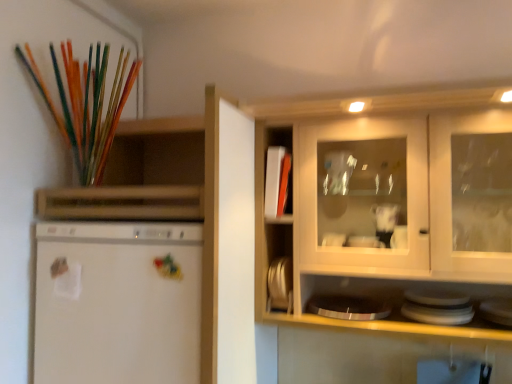
Question: From a real-world perspective, does white glossy plate at lower right, acting as the second appliance starting from the left, sit lower than metallic silver plates at center, the second appliance in the right-to-left sequence?

Choices:
 (A) yes
 (B) no

Answer: (A)

Question: Does white glossy plate at lower right, which is the second appliance from back to front, appear on the left side of metallic silver plates at center, positioned as the first appliance in left-to-right order?

Choices:
 (A) yes
 (B) no

Answer: (B)

Question: Is the position of white glossy plate at lower right, which is the second appliance from back to front, more distant than that of metallic silver plates at center, the second appliance in the right-to-left sequence?

Choices:
 (A) no
 (B) yes

Answer: (A)

Question: Is white glossy plate at lower right, acting as the second appliance starting from the left, wider than metallic silver plates at center, the second appliance in the front-to-back sequence?

Choices:
 (A) yes
 (B) no

Answer: (A)

Question: Is white glossy plate at lower right, which is the second appliance from back to front, oriented towards metallic silver plates at center, the second appliance in the front-to-back sequence?

Choices:
 (A) yes
 (B) no

Answer: (B)

Question: Can you confirm if white glossy plate at lower right, placed as the 1th appliance when sorted from front to back, is bigger than metallic silver plates at center, the second appliance in the front-to-back sequence?

Choices:
 (A) yes
 (B) no

Answer: (A)

Question: Can you confirm if white matte refrigerator at left is smaller than metallic silver plates at center, the second appliance in the right-to-left sequence?

Choices:
 (A) no
 (B) yes

Answer: (A)

Question: Does white matte refrigerator at left have a greater width compared to metallic silver plates at center, the second appliance in the front-to-back sequence?

Choices:
 (A) yes
 (B) no

Answer: (A)

Question: Would you say white matte refrigerator at left contains metallic silver plates at center, positioned as the first appliance in left-to-right order?

Choices:
 (A) yes
 (B) no

Answer: (B)

Question: Can you confirm if white matte refrigerator at left is positioned to the left of metallic silver plates at center, positioned as the first appliance in left-to-right order?

Choices:
 (A) no
 (B) yes

Answer: (B)

Question: Is white matte refrigerator at left located outside metallic silver plates at center, the first appliance when ordered from back to front?

Choices:
 (A) no
 (B) yes

Answer: (B)

Question: From a real-world perspective, is white matte refrigerator at left on metallic silver plates at center, the second appliance in the front-to-back sequence?

Choices:
 (A) no
 (B) yes

Answer: (A)

Question: Is the depth of white matte refrigerator at left greater than that of white glossy plate at lower right, acting as the second appliance starting from the left?

Choices:
 (A) no
 (B) yes

Answer: (A)